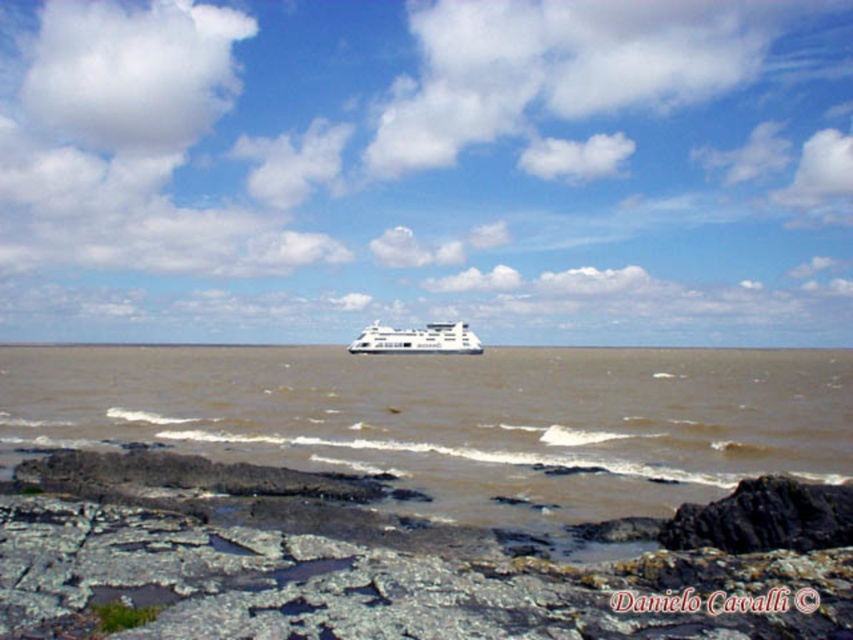
Question: Does brown matte water at center appear on the left side of white glossy cruise ship at center?

Choices:
 (A) no
 (B) yes

Answer: (A)

Question: Does brown matte water at center appear on the left side of white glossy cruise ship at center?

Choices:
 (A) no
 (B) yes

Answer: (A)

Question: Which of the following is the closest to the observer?

Choices:
 (A) white glossy cruise ship at center
 (B) brown matte water at center

Answer: (B)

Question: Can you confirm if brown matte water at center is smaller than white glossy cruise ship at center?

Choices:
 (A) no
 (B) yes

Answer: (A)

Question: Which of the following is the closest to the observer?

Choices:
 (A) (466, 342)
 (B) (206, 448)

Answer: (B)